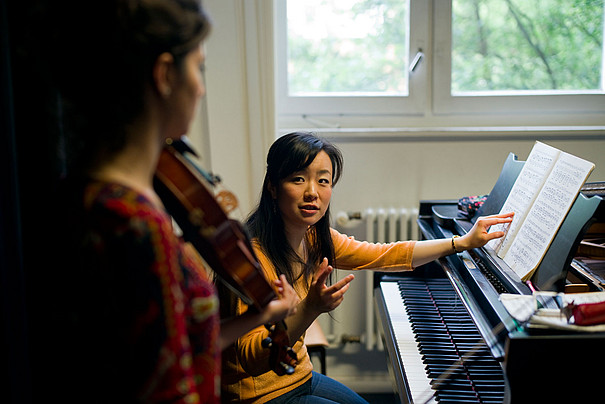
Image resolution: width=605 pixels, height=404 pixels. I want to click on handle to open the wondow, so (x=417, y=63).